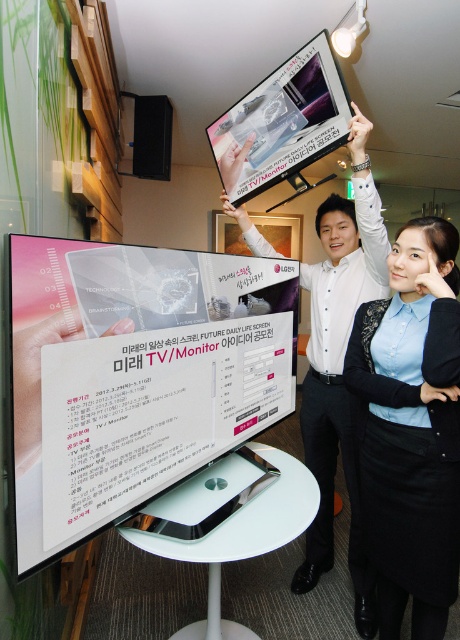
You are an interior designer planning to arrange two monitors in a modern office. You want to place the metallic silver monitor at center and the satin black monitor at upper center in a vertical alignment. According to the scene description, is this arrangement possible?

Yes, the arrangement is possible because the metallic silver monitor at center is located below the satin black monitor at upper center, indicating they are already in a vertical alignment as desired.

You are an event participant standing in the office and want to reach the white glossy screen at left. Can you touch it without moving your feet? Your arm length is 80 centimeters.

The white glossy screen at left is 91.22 centimeters away from you, which is farther than your 80 centimeter arm length. You cannot touch it without moving your feet.